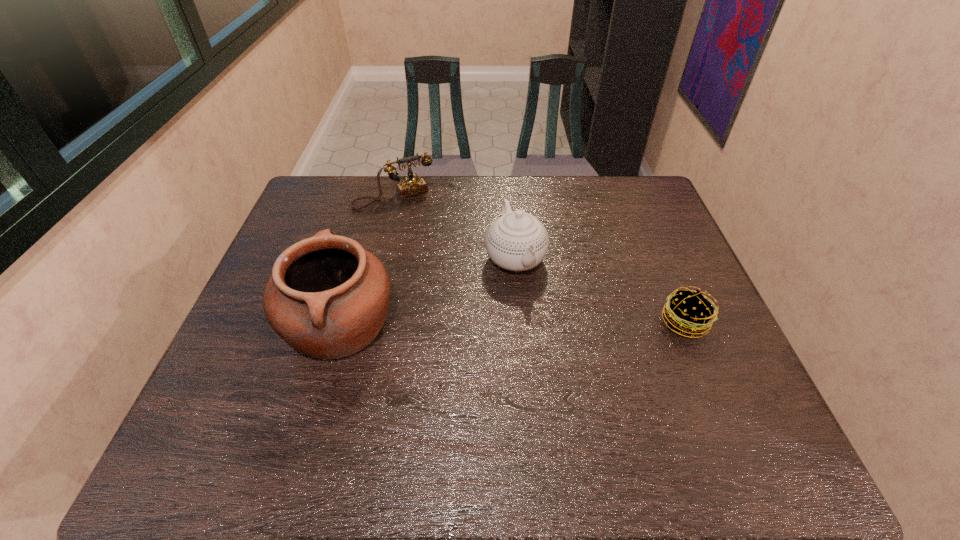
Identify the location of free space on the desktop that is between the tallest object and the shortest object and is positioned on the front-facing side of the farthest object. This screenshot has width=960, height=540. (465, 324).

This screenshot has height=540, width=960. I want to click on vacant space on the desktop that is between the tallest object and the rightmost object and is positioned on the spout of the chinaware, so click(x=548, y=323).